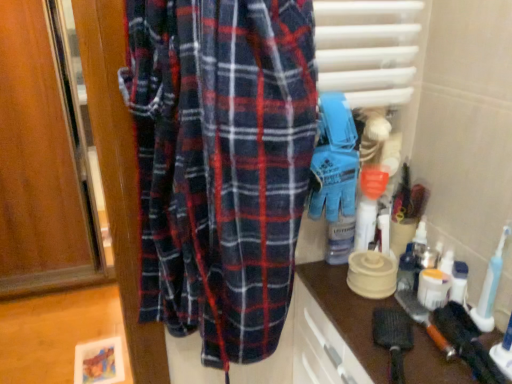
Question: Does blue rubber gloves at center lie in front of black rubber toothbrush at lower right?

Choices:
 (A) no
 (B) yes

Answer: (B)

Question: Is blue rubber gloves at center facing away from black rubber toothbrush at lower right?

Choices:
 (A) no
 (B) yes

Answer: (A)

Question: Is blue rubber gloves at center oriented towards black rubber toothbrush at lower right?

Choices:
 (A) no
 (B) yes

Answer: (A)

Question: Does blue rubber gloves at center have a larger size compared to black rubber toothbrush at lower right?

Choices:
 (A) yes
 (B) no

Answer: (A)

Question: Considering the relative sizes of blue rubber gloves at center and black rubber toothbrush at lower right in the image provided, is blue rubber gloves at center shorter than black rubber toothbrush at lower right?

Choices:
 (A) yes
 (B) no

Answer: (B)

Question: Does point (328, 215) appear closer or farther from the camera than point (434, 324)?

Choices:
 (A) farther
 (B) closer

Answer: (A)

Question: In terms of width, does blue rubber gloves at center look wider or thinner when compared to black rubber toothbrush at lower right?

Choices:
 (A) wide
 (B) thin

Answer: (A)

Question: In the image, is blue rubber gloves at center on the left side or the right side of black rubber toothbrush at lower right?

Choices:
 (A) right
 (B) left

Answer: (B)

Question: In terms of height, does blue rubber gloves at center look taller or shorter compared to black rubber toothbrush at lower right?

Choices:
 (A) short
 (B) tall

Answer: (B)

Question: From a real-world perspective, is blue rubber gloves at center above or below brown matte countertop at lower right?

Choices:
 (A) below
 (B) above

Answer: (B)

Question: In terms of height, does blue rubber gloves at center look taller or shorter compared to brown matte countertop at lower right?

Choices:
 (A) tall
 (B) short

Answer: (B)

Question: Considering their positions, is blue rubber gloves at center located in front of or behind brown matte countertop at lower right?

Choices:
 (A) behind
 (B) front

Answer: (A)

Question: Considering the positions of point (324, 188) and point (373, 306), is point (324, 188) closer or farther from the camera than point (373, 306)?

Choices:
 (A) closer
 (B) farther

Answer: (A)

Question: Based on their positions, is brown matte countertop at lower right located to the left or right of blue rubber gloves at center?

Choices:
 (A) right
 (B) left

Answer: (A)

Question: Considering the positions of brown matte countertop at lower right and blue rubber gloves at center in the image, is brown matte countertop at lower right taller or shorter than blue rubber gloves at center?

Choices:
 (A) tall
 (B) short

Answer: (A)